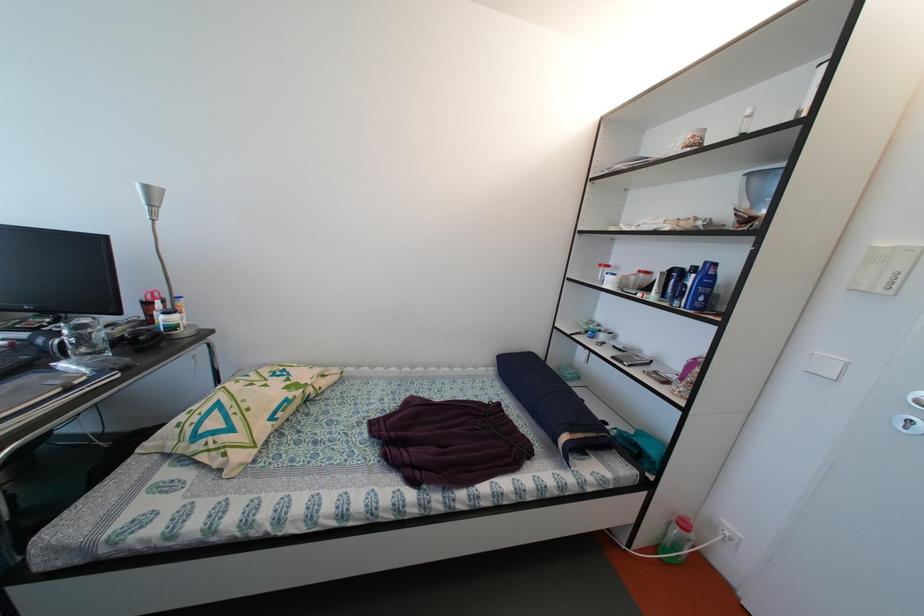
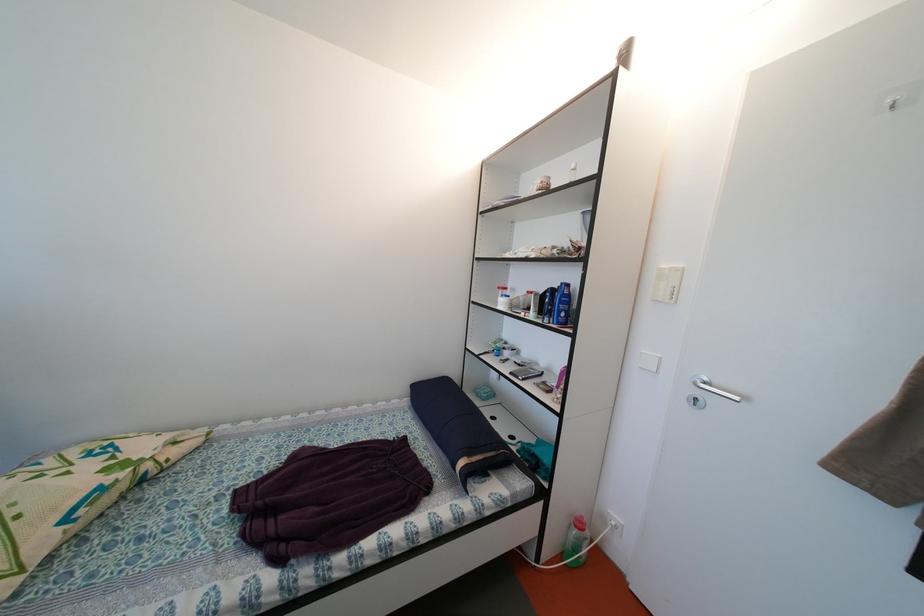
Locate, in the second image, the point that corresponds to point (720, 533) in the first image.

(611, 525)